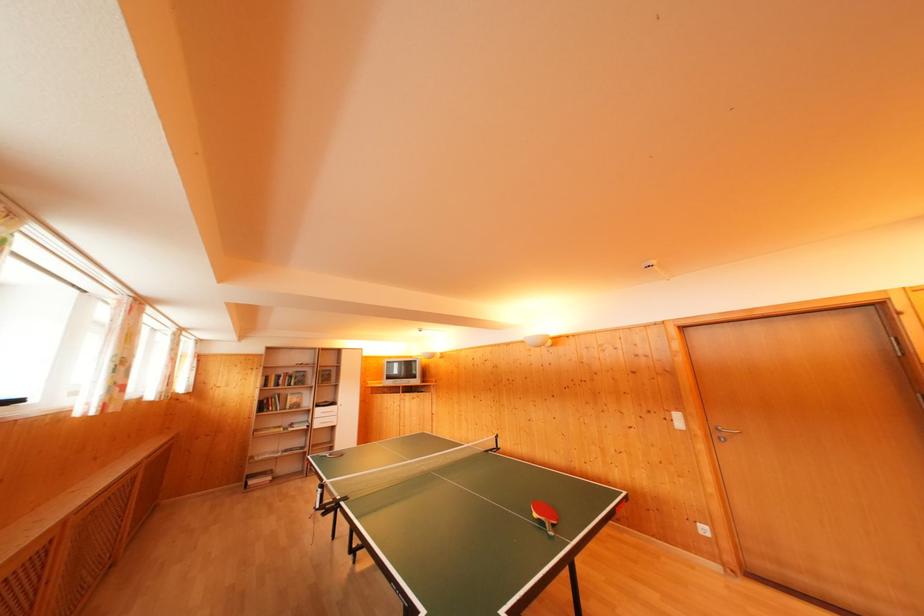
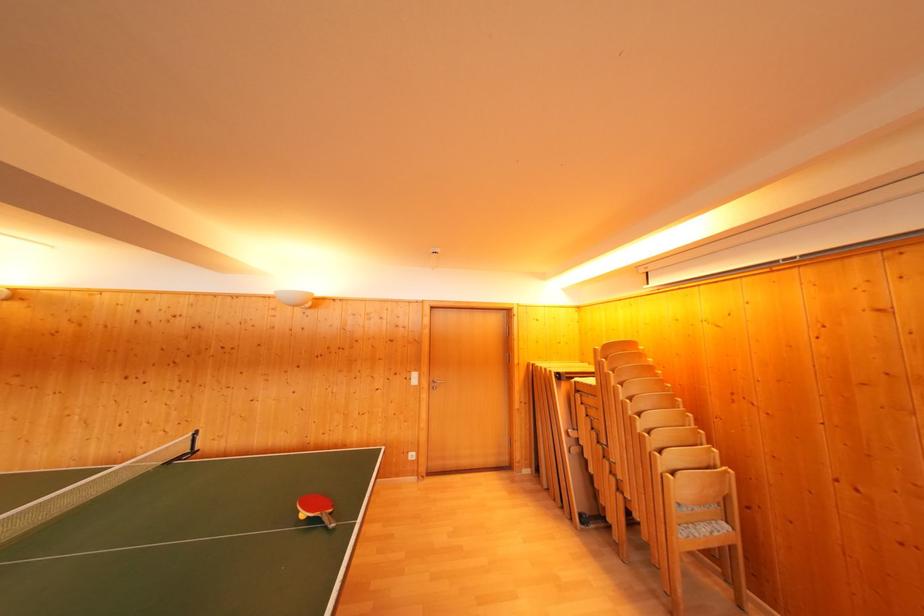
Question: How did the camera likely rotate?

Choices:
 (A) Left
 (B) Right
 (C) Up
 (D) Down

Answer: (B)